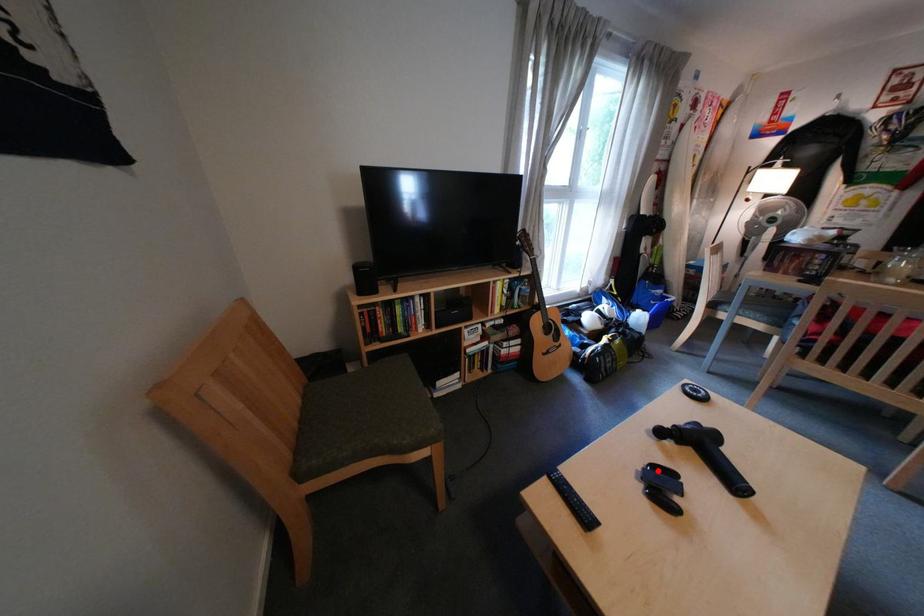
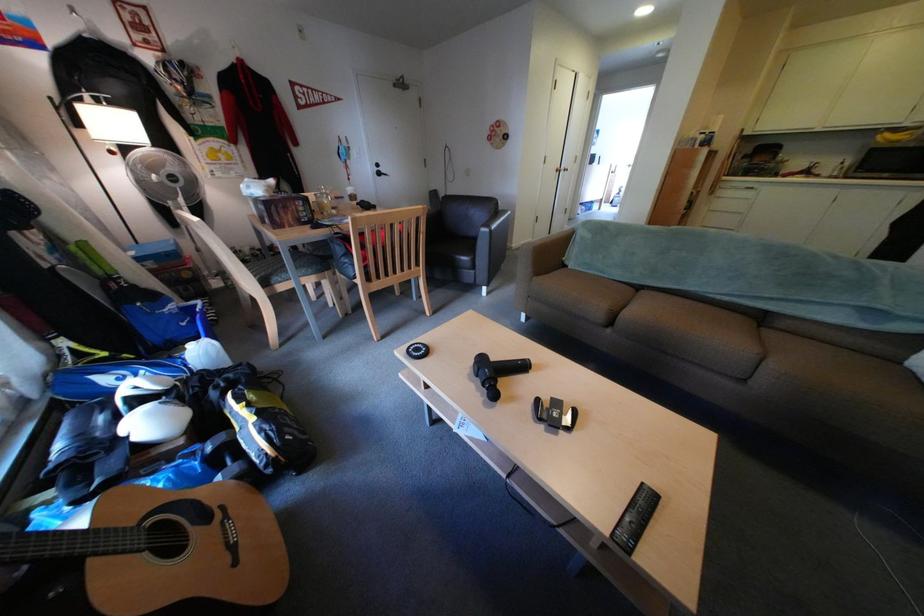
Locate, in the second image, the point that corresponds to the highlighted location in the first image.

(564, 426)